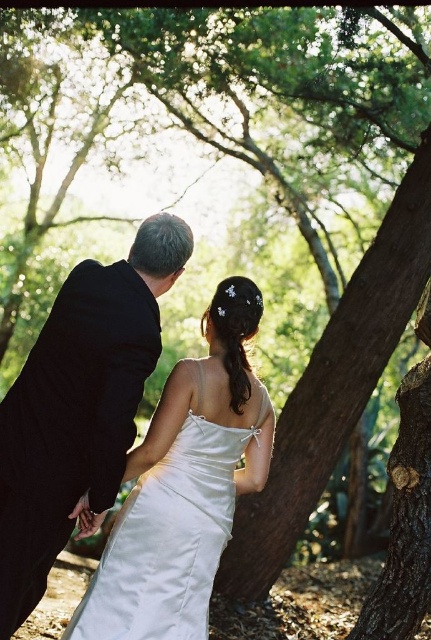
You are a photographer positioned at the center of the scene. You want to capture a closeup shot of the woman in the white wedding dress without including the black satin suit at left in the frame. Based on their positions, is this possible?

The black satin suit at left is located at point (78, 406), so if the photographer is at the center, they can adjust the camera angle to exclude the black satin suit at left while focusing on the woman in the white wedding dress.

You are standing at the point labeled point [12,504] and want to move to the point labeled point [228,515]. Is there a clear path between these two points without any obstacles?

Yes, there is a clear path between point [12,504] and point [228,515] because the first point is in front of the second one, indicating no obstruction between them.

You are a photographer positioned at point (78, 406). You need to capture a photo of the woman in white wedding dress. Is the black satin suit at left blocking your view of the woman in white wedding dress?

The black satin suit at left is located at point (78, 406). Since you are positioned at the same point, the black satin suit at left is right where you are standing, so it would block your view of the woman in white wedding dress.